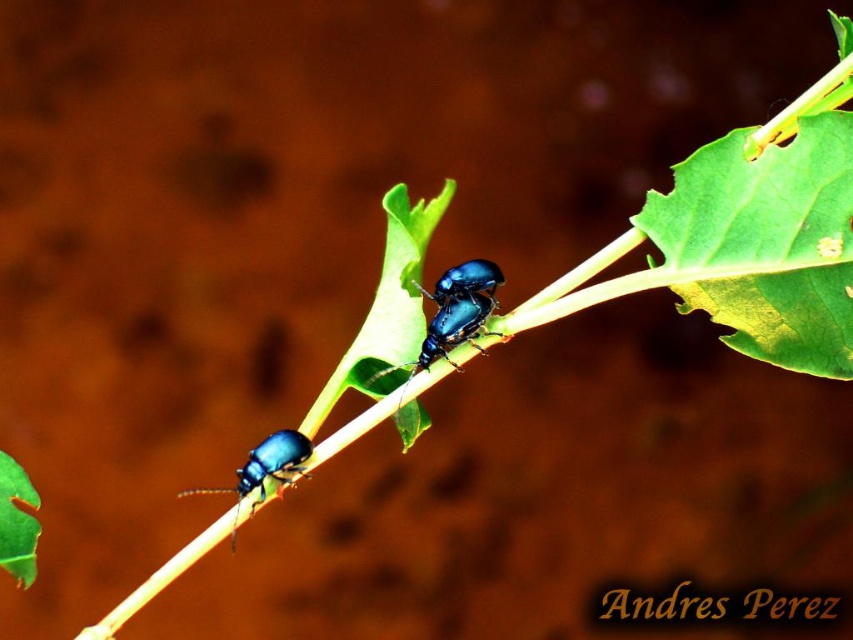
Question: Which point is farther from the camera taking this photo?

Choices:
 (A) (265, 440)
 (B) (468, 285)
 (C) (709, 292)

Answer: (B)

Question: Among these objects, which one is nearest to the camera?

Choices:
 (A) green matte leaf at upper right
 (B) metallic blue beetle at lower left

Answer: (A)

Question: Which of the following is the closest to the observer?

Choices:
 (A) green matte leaf at upper right
 (B) metallic blue beetle at center

Answer: (A)

Question: Does green matte leaf at upper right appear under metallic blue beetle at center?

Choices:
 (A) yes
 (B) no

Answer: (B)

Question: Can you confirm if green matte leaf at upper right is wider than metallic blue beetle at center?

Choices:
 (A) yes
 (B) no

Answer: (A)

Question: Can you confirm if metallic blue beetle at lower left is bigger than metallic blue beetle at center?

Choices:
 (A) no
 (B) yes

Answer: (B)